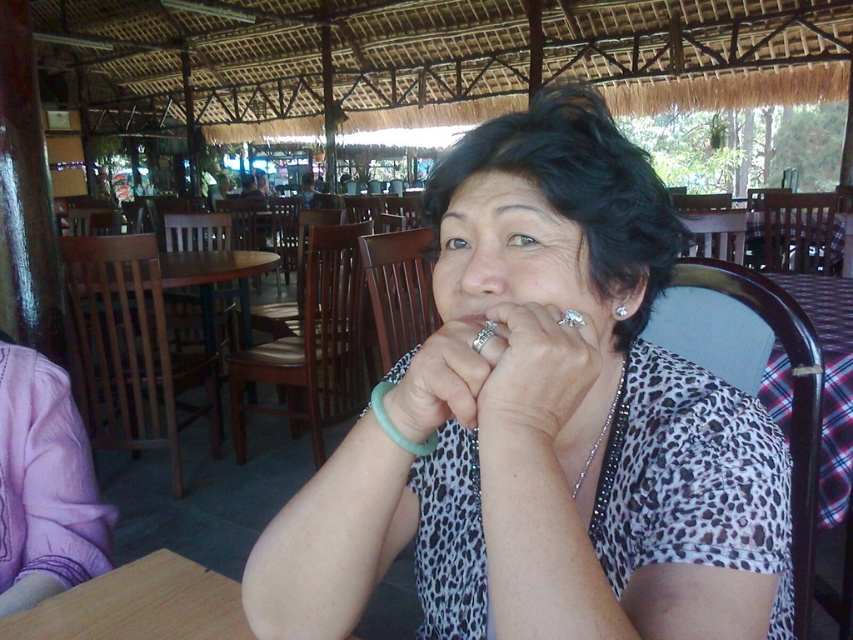
You are a jeweler who needs to retrieve the silver metallic ring at center from the table where it is placed near the leopard print shirt at center. Given that your hand can reach 1.2 inches, can you grab the ring without moving the shirt?

The distance between the silver metallic ring at center and leopard print shirt at center is 1.36 inches. Since your hand can only reach 1.2 inches, you cannot grab the ring without moving the shirt.

You are a jeweler examining the silver metallic ring at center and the leopard print shirt at center worn by the woman in the image. Which object has a smaller width?

The silver metallic ring at center has a lesser width compared to the leopard print shirt at center.

You are a fashion designer observing the leopard print shirt at center and the teal rubber bracelet at lower center. Which item would require more fabric to produce?

The leopard print shirt at center requires more fabric to produce because it is bigger than the teal rubber bracelet at lower center.